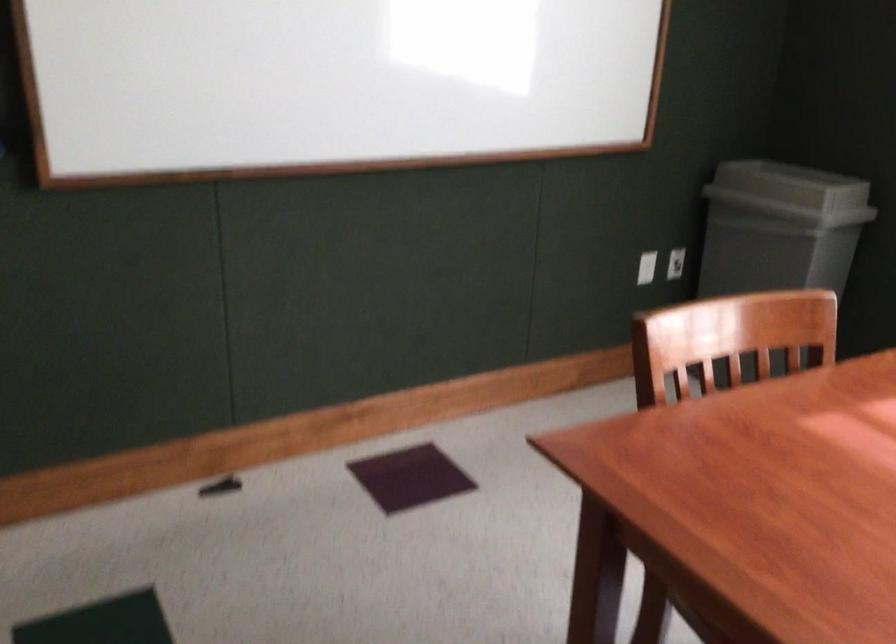
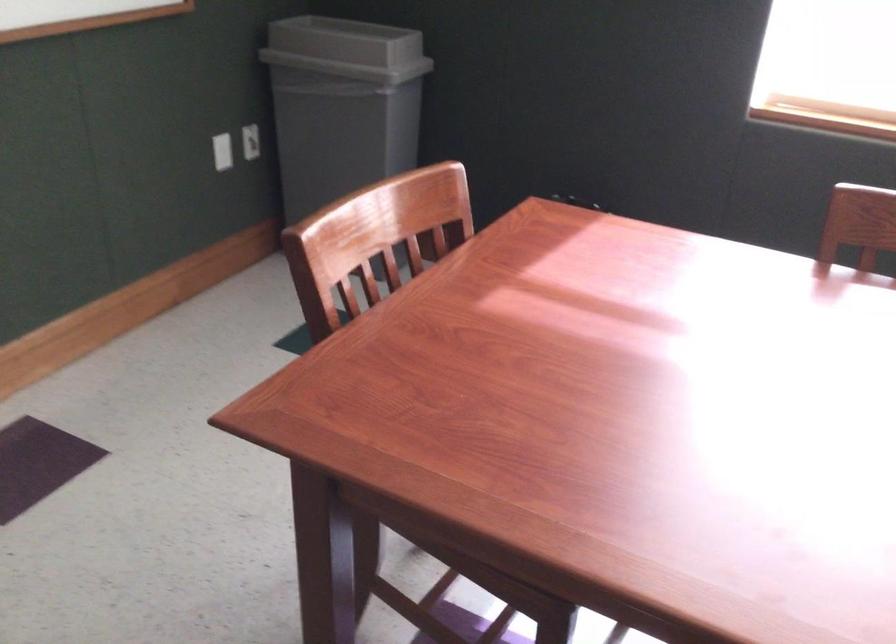
Locate, in the second image, the point that corresponds to point (782, 185) in the first image.

(346, 49)